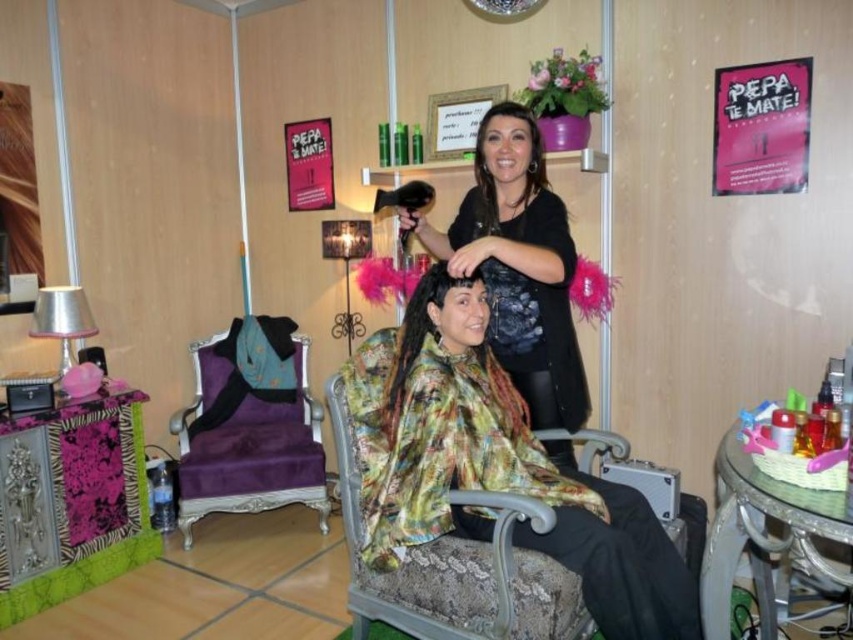
Between point (567, 440) and point (479, 134), which one is positioned behind?

The point (567, 440) is behind.

Between floral silk robe at center and dark brown silky hair at upper center, which one is positioned lower?

floral silk robe at center is lower down.

Find the location of `floral silk robe at center`. floral silk robe at center is located at coordinates (518, 266).

I want to click on floral silk robe at center, so point(518,266).

Who is more distant from viewer, (419, 560) or (323, 516)?

The point (323, 516) is more distant.

Does point (589, 624) lie in front of point (248, 500)?

Yes, it is.

Where is `silk floral-patterned chair at center`? Image resolution: width=853 pixels, height=640 pixels. silk floral-patterned chair at center is located at coordinates (457, 566).

Consider the image. Does silk floral-patterned chair at center have a lesser width compared to dark brown silky hair at upper center?

No, silk floral-patterned chair at center is not thinner than dark brown silky hair at upper center.

Is silk floral-patterned chair at center wider than dark brown silky hair at upper center?

Yes, silk floral-patterned chair at center is wider than dark brown silky hair at upper center.

Between point (437, 556) and point (535, 173), which one is positioned behind?

The point (535, 173) is more distant.

Image resolution: width=853 pixels, height=640 pixels. I want to click on silk floral-patterned chair at center, so click(x=457, y=566).